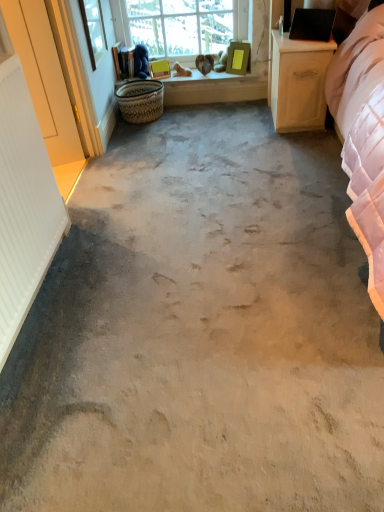
What are the coordinates of `free space in front of light wood/wooden nightstand at right` in the screenshot? It's located at (294, 146).